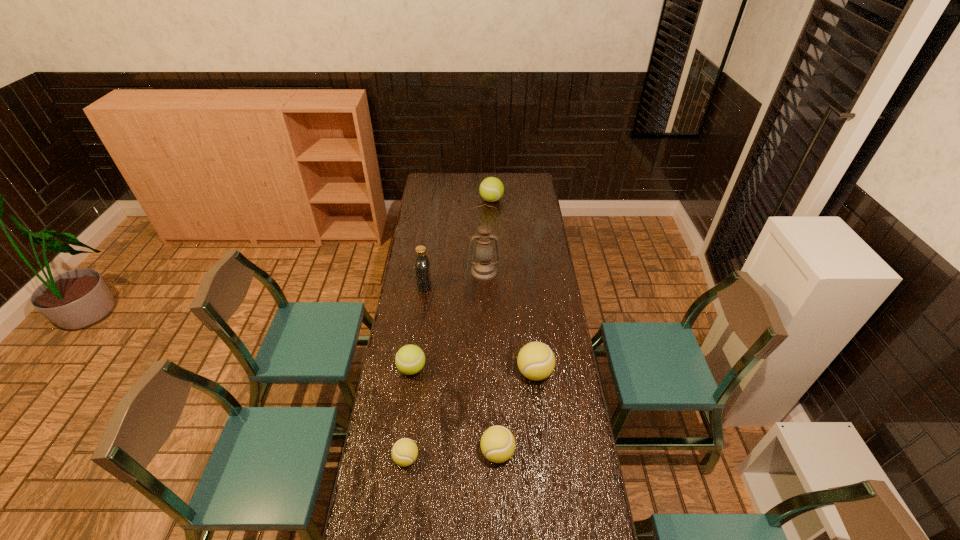
Locate an element on the screen. This screenshot has width=960, height=540. gray oil lamp is located at coordinates (484, 268).

The height and width of the screenshot is (540, 960). In order to click on oil lamp in this screenshot , I will do `click(484, 268)`.

Image resolution: width=960 pixels, height=540 pixels. Find the location of `vodka`. vodka is located at coordinates (422, 265).

Locate an element on the screen. the rightmost tennis ball is located at coordinates (536, 361).

Image resolution: width=960 pixels, height=540 pixels. In order to click on the farthest yellow tennis ball in this screenshot , I will do `click(536, 361)`.

At what (x,y) coordinates should I click in order to perform the action: click on the farthest object. Please return your answer as a coordinate pair (x, y). This screenshot has height=540, width=960. Looking at the image, I should click on (491, 189).

At what (x,y) coordinates should I click in order to perform the action: click on the bigger green tennis ball. Please return your answer as a coordinate pair (x, y). This screenshot has height=540, width=960. Looking at the image, I should click on (491, 189).

Identify the location of the second yellow tennis ball from left to right. Image resolution: width=960 pixels, height=540 pixels. coord(497,443).

I want to click on the smaller green tennis ball, so click(x=410, y=359).

Find the location of a particular element. The width and height of the screenshot is (960, 540). the left green tennis ball is located at coordinates (410, 359).